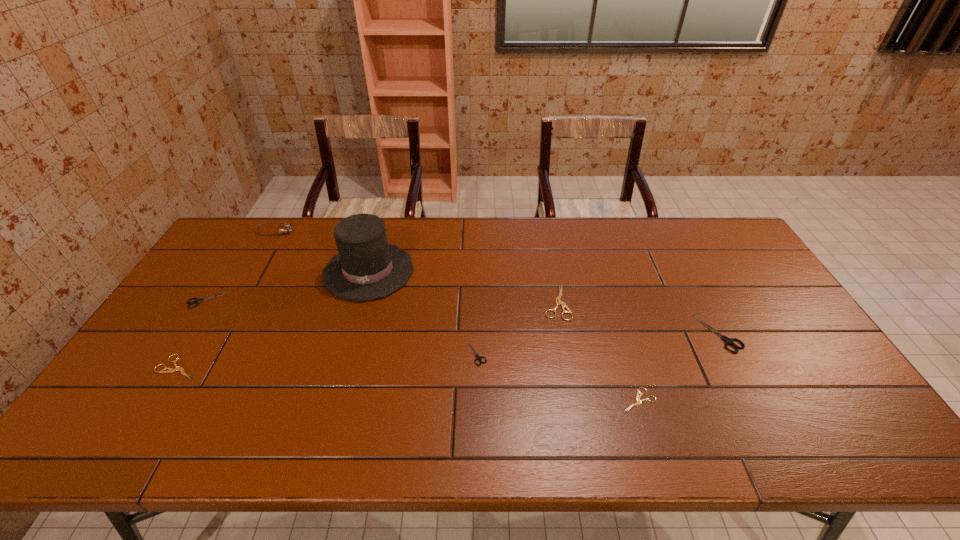
Locate an element on the screen. vacant region located on the front of the farthest beige shears is located at coordinates (575, 404).

In order to click on free region located 0.220m on the right of the leftmost beige shears in this screenshot , I will do `click(286, 367)`.

Find the location of `free space located on the right of the second black shears from left to right`. free space located on the right of the second black shears from left to right is located at coordinates (602, 353).

Where is `free region located 0.170m on the left of the smallest beige shears`? The width and height of the screenshot is (960, 540). free region located 0.170m on the left of the smallest beige shears is located at coordinates (552, 400).

Identify the location of dress hat at the far edge. The width and height of the screenshot is (960, 540). (366, 267).

Locate an element on the screen. goggles located at the far edge is located at coordinates pos(286,228).

At what (x,y) coordinates should I click in order to perform the action: click on goggles at the left edge. Please return your answer as a coordinate pair (x, y). This screenshot has width=960, height=540. Looking at the image, I should click on (286, 228).

The height and width of the screenshot is (540, 960). Identify the location of object that is at the far left corner. (286, 228).

Locate an element on the screen. This screenshot has width=960, height=540. vacant space at the far edge of the desktop is located at coordinates (521, 228).

Where is `free space at the near edge of the desktop`? free space at the near edge of the desktop is located at coordinates (760, 453).